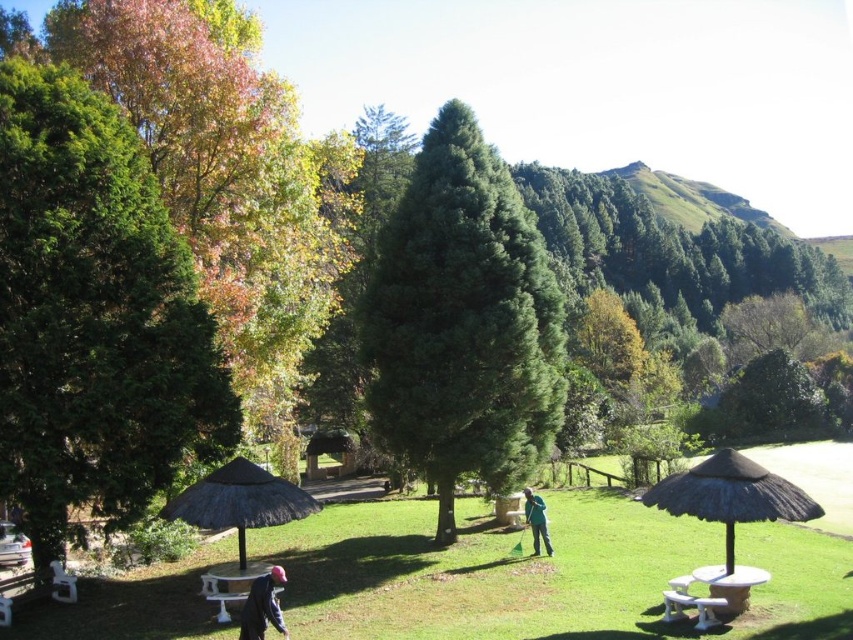
Is point (526, 237) positioned behind point (715, 588)?

Yes.

Can you confirm if green matte tree at center is positioned above white plastic picnic table at lower right?

Correct, green matte tree at center is located above white plastic picnic table at lower right.

Between point (418, 432) and point (675, 598), which one is positioned in front?

Point (675, 598) is more forward.

At what (x,y) coordinates should I click in order to perform the action: click on green matte tree at center. Please return your answer as a coordinate pair (x, y). Looking at the image, I should click on (463, 321).

Is point (392, 246) less distant than point (242, 625)?

That is False.

Can you confirm if green matte tree at center is positioned to the right of dark blue jacket at lower left?

Yes, green matte tree at center is to the right of dark blue jacket at lower left.

Describe the element at coordinates (463, 321) in the screenshot. I see `green matte tree at center` at that location.

In order to click on green matte tree at center in this screenshot , I will do `click(463, 321)`.

Is white plastic picnic table at lower right closer to camera compared to brown thatched hut at center?

Yes, white plastic picnic table at lower right is closer to the viewer.

Who is more distant from viewer, (691,573) or (326,472)?

Point (326,472)

You are a GUI agent. You are given a task and a screenshot of the screen. Output one action in this format:
    pyautogui.click(x=<x>, y=<y>)
    Task: Click on the white plastic picnic table at lower right
    This screenshot has width=853, height=640.
    Given the screenshot: What is the action you would take?
    pyautogui.click(x=711, y=593)